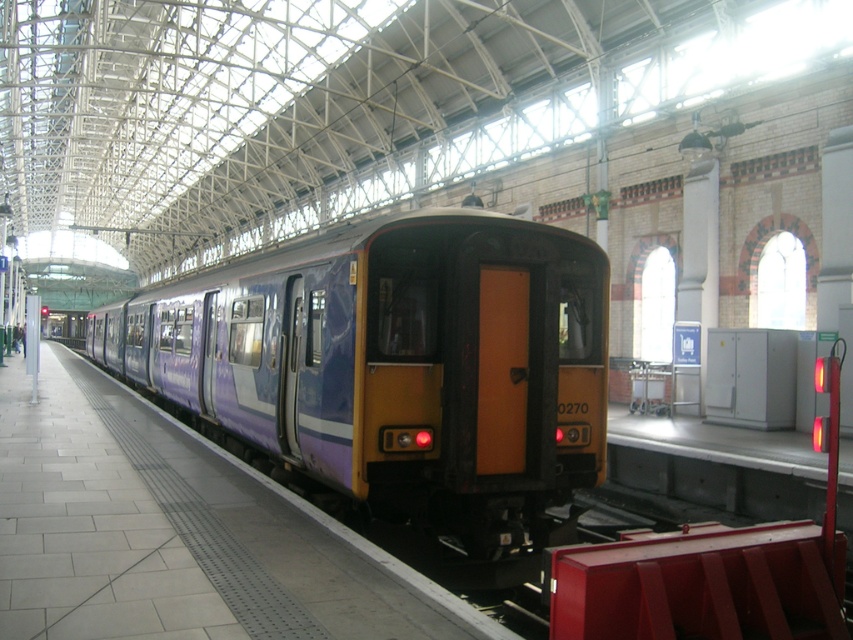
You are a maintenance worker needing to inspect the gap between the purple matte train at center and the purple glossy platform at center. You have a measuring tape that can extend up to 2 meters. Can you measure the gap between them without needing to extend the tape beyond its maximum length?

The distance between the purple matte train at center and the purple glossy platform at center is 2.18 meters. Since the measuring tape can only extend up to 2 meters, it cannot fully measure the gap as it requires 0.18 meters more extension. Therefore, the tape will not reach the full distance.

You are a passenger waiting on the platform and want to board the purple matte train at center. The purple glossy platform at center has a red barrier blocking the way. Can you walk directly to the train without crossing the barrier?

The purple glossy platform at center is behind the purple matte train at center, so you can walk directly to the train without needing to cross the barrier since the platform section with the barrier is behind the train.